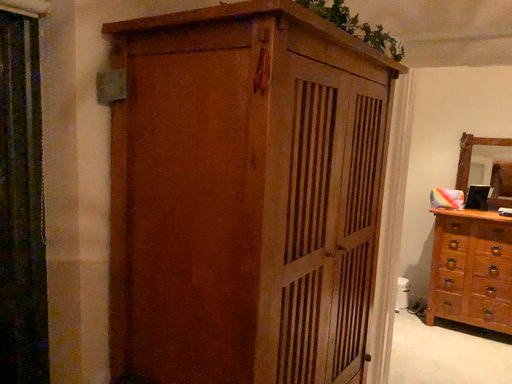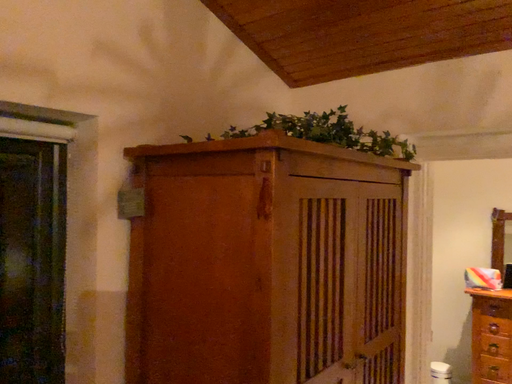
Question: How did the camera likely rotate when shooting the video?

Choices:
 (A) rotated upward
 (B) rotated downward

Answer: (A)